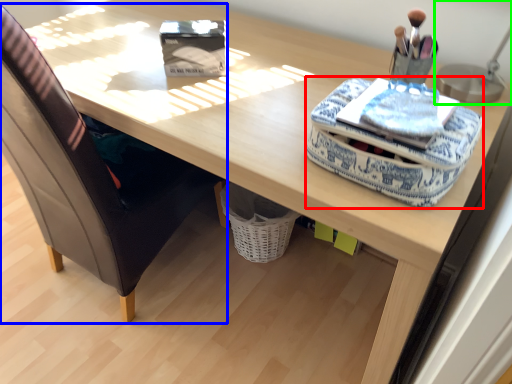
Question: Which is farther away from material (highlighted by a red box)? chair (highlighted by a blue box) or table lamp (highlighted by a green box)?

Choices:
 (A) chair
 (B) table lamp

Answer: (A)